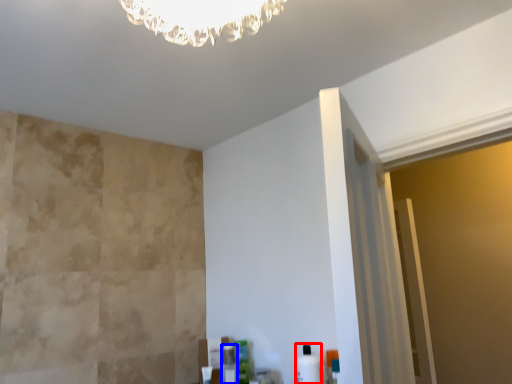
Question: Which of the following is the closest to the observer, toiletry (highlighted by a red box) or toiletry (highlighted by a blue box)?

Choices:
 (A) toiletry
 (B) toiletry

Answer: (A)